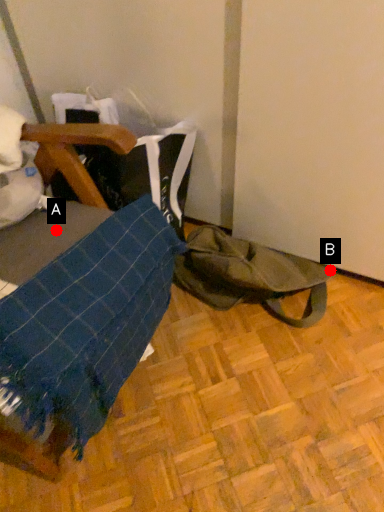
Question: Two points are circled on the image, labeled by A and B beside each circle. Which of the following is the closest to the observer?

Choices:
 (A) A is closer
 (B) B is closer

Answer: (A)